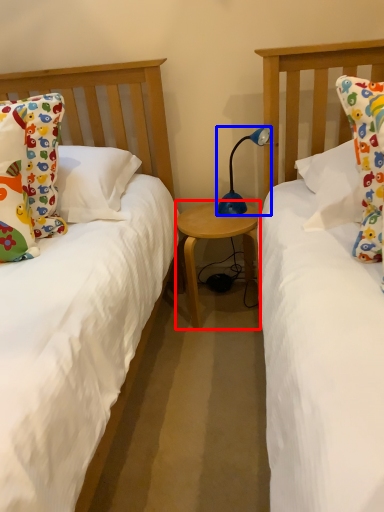
Question: Among these objects, which one is farthest to the camera, table (highlighted by a red box) or lamp (highlighted by a blue box)?

Choices:
 (A) table
 (B) lamp

Answer: (A)